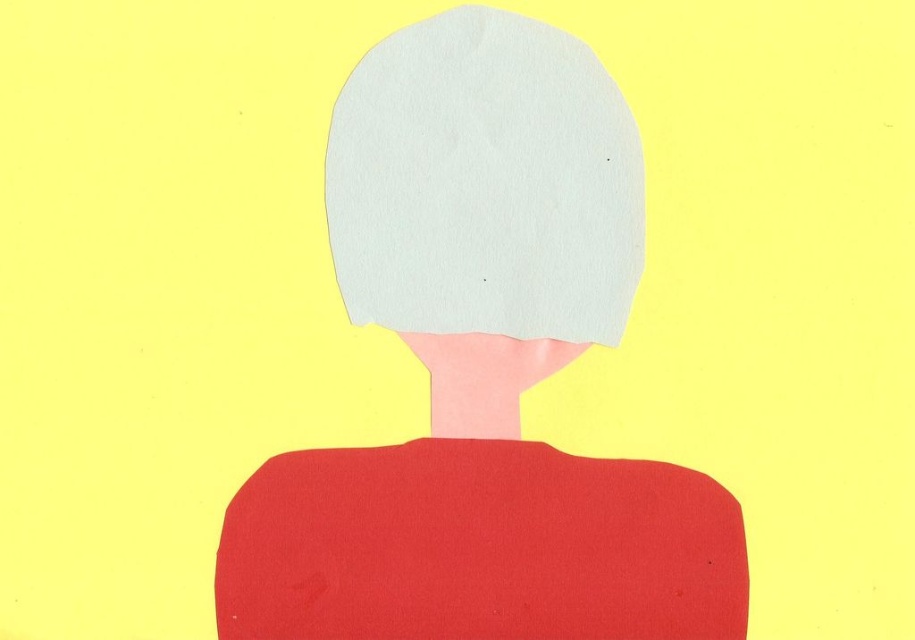
Question: Is white paper head at center wider than white paper at center?

Choices:
 (A) yes
 (B) no

Answer: (A)

Question: Which point appears closest to the camera in this image?

Choices:
 (A) (369, 211)
 (B) (600, 173)

Answer: (B)

Question: Can you confirm if white paper head at center is positioned above white paper at center?

Choices:
 (A) no
 (B) yes

Answer: (A)

Question: Which point appears farthest from the camera in this image?

Choices:
 (A) (477, 301)
 (B) (590, 260)

Answer: (A)

Question: Can you confirm if white paper head at center is wider than white paper at center?

Choices:
 (A) yes
 (B) no

Answer: (A)